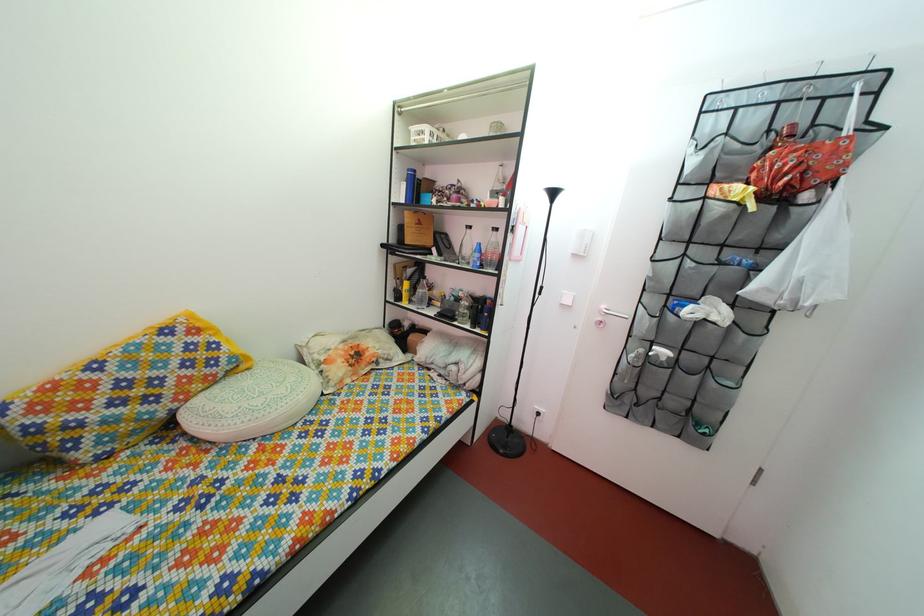
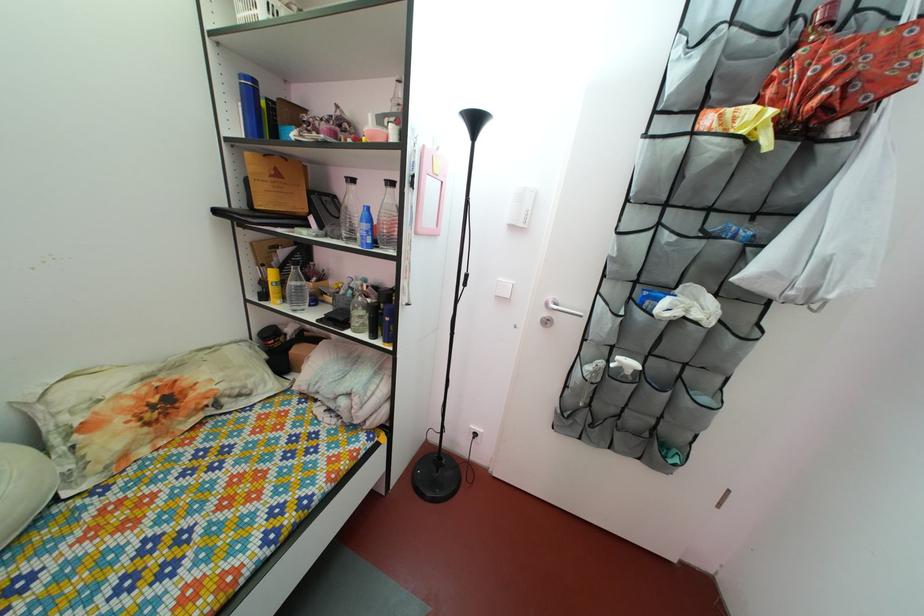
The point at (419, 280) is marked in the first image. Where is the corresponding point in the second image?

(292, 262)